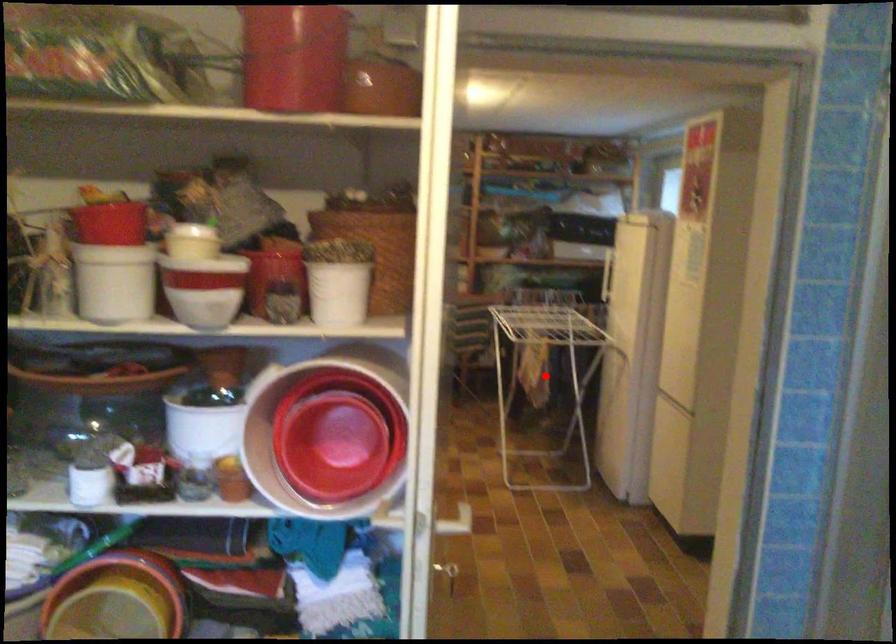
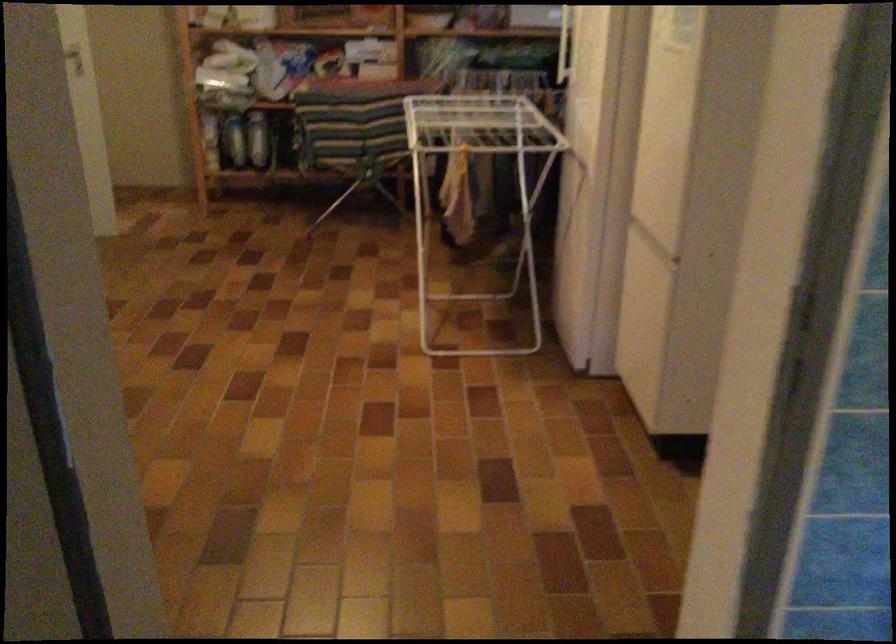
Question: I am providing you with two images of the same scene from different viewpoints. A red point is marked on the first image. Can you still see the location of the red point in image 2?

Choices:
 (A) Yes
 (B) No

Answer: (B)